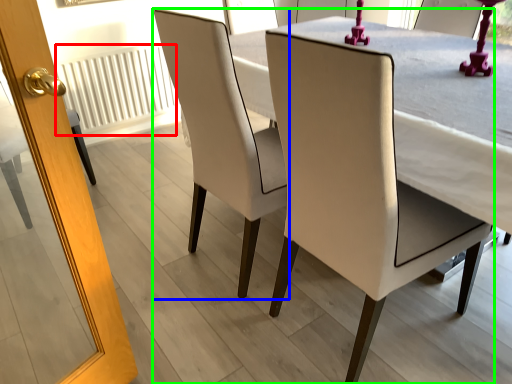
Question: Which object is the closest to the radiator (highlighted by a red box)? Choose among these: chair (highlighted by a blue box) or chair (highlighted by a green box).

Choices:
 (A) chair
 (B) chair

Answer: (A)